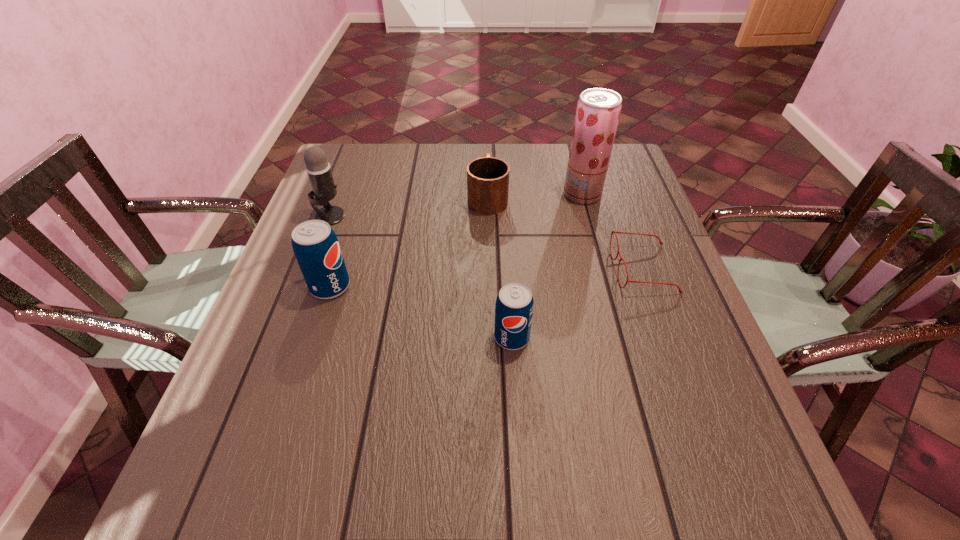
This screenshot has height=540, width=960. In order to click on free spot located on the left of the tallest object in this screenshot , I will do `click(492, 194)`.

Locate an element on the screen. The image size is (960, 540). vacant space located on the face of the spectacles is located at coordinates (487, 269).

The height and width of the screenshot is (540, 960). Identify the location of vacant area located on the face of the spectacles. (585, 269).

This screenshot has width=960, height=540. I want to click on vacant space located 0.400m on the face of the spectacles, so click(x=444, y=269).

I want to click on free region located 0.130m on the right of the second tallest object, so click(394, 216).

In order to click on free space located on the side of the fifth tallest object with the handle in this screenshot , I will do `click(487, 143)`.

Locate an element on the screen. Image resolution: width=960 pixels, height=540 pixels. free space located 0.160m on the side of the fifth tallest object with the handle is located at coordinates (487, 151).

Locate an element on the screen. The width and height of the screenshot is (960, 540). free location located 0.090m on the side of the fifth tallest object with the handle is located at coordinates (487, 163).

Locate an element on the screen. The width and height of the screenshot is (960, 540). fruit juice at the far edge is located at coordinates (598, 110).

At what (x,y) coordinates should I click in order to perform the action: click on mug at the far edge. Please return your answer as a coordinate pair (x, y). Looking at the image, I should click on (487, 177).